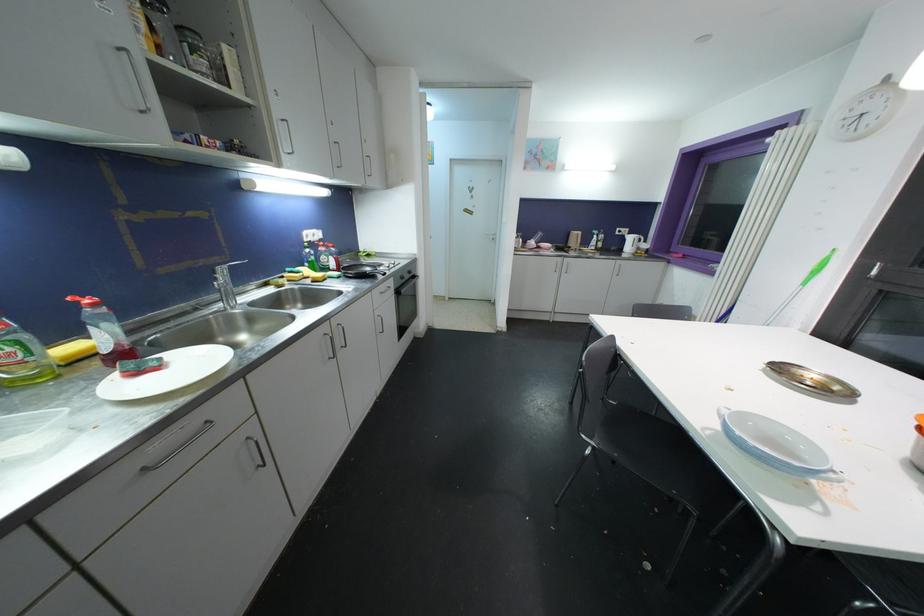
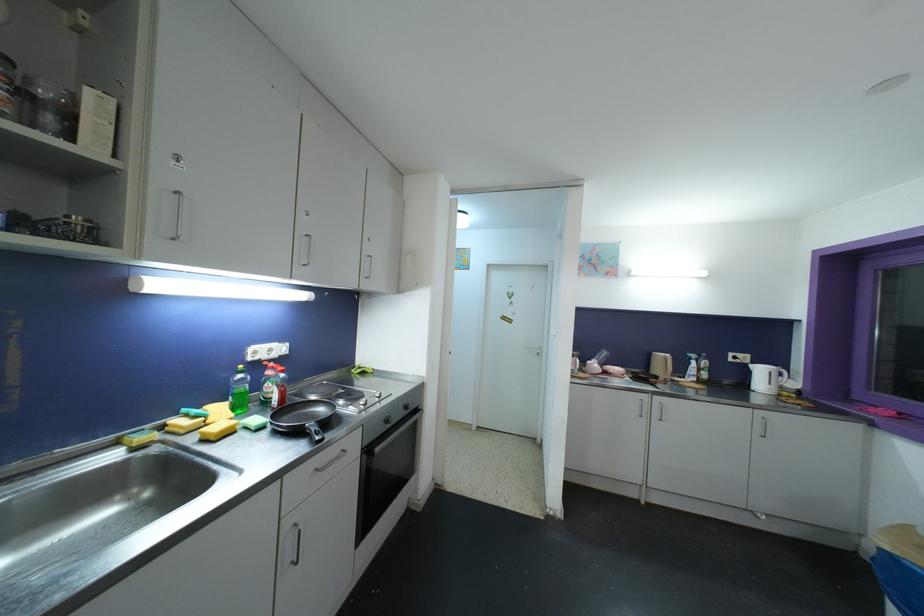
Question: Which direction would the cameraman need to move to produce the second image? Reply with the corresponding letter.

Choices:
 (A) Left
 (B) Right
 (C) Forward
 (D) Backward

Answer: (C)